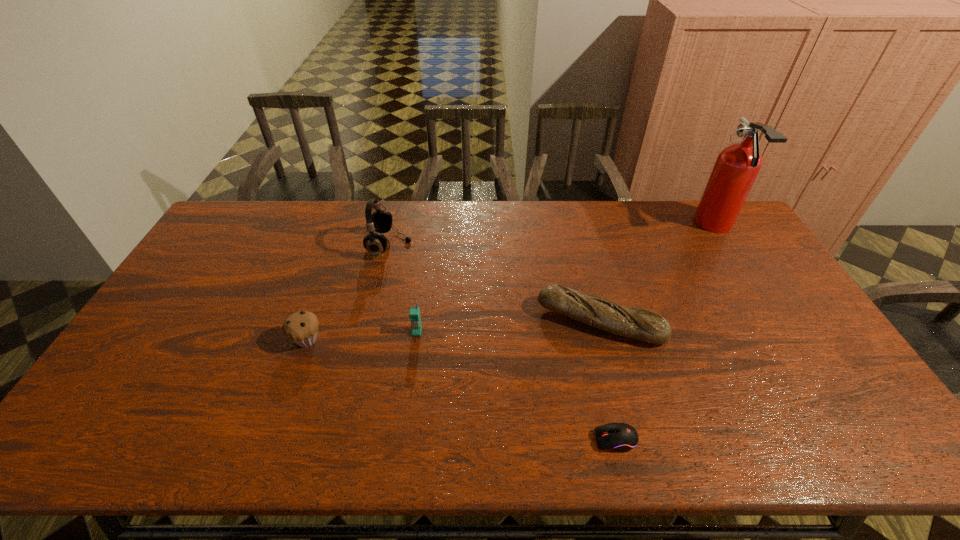
Locate an element on the screen. The height and width of the screenshot is (540, 960). free space located 0.260m on the left of the tallest object is located at coordinates (623, 226).

Find the location of `vacant space situated 0.400m with the microphone on the side of the fifth object from right to left`. vacant space situated 0.400m with the microphone on the side of the fifth object from right to left is located at coordinates (527, 245).

Where is `blank space located 0.220m on the keypad of the cellular telephone`? The height and width of the screenshot is (540, 960). blank space located 0.220m on the keypad of the cellular telephone is located at coordinates (407, 408).

Identify the location of vacant space located on the right of the muffin. (381, 340).

Where is `free space located 0.130m on the right of the baguet`? This screenshot has height=540, width=960. free space located 0.130m on the right of the baguet is located at coordinates (708, 322).

At what (x,y) coordinates should I click in order to perform the action: click on vacant space located 0.210m on the right of the nearest object. Please return your answer as a coordinate pair (x, y). Looking at the image, I should click on (728, 439).

Find the location of a particular element. Image resolution: width=960 pixels, height=540 pixels. fire extinguisher that is at the far edge is located at coordinates pyautogui.click(x=737, y=166).

Find the location of a particular element. This screenshot has width=960, height=540. headset that is at the far edge is located at coordinates (379, 221).

This screenshot has width=960, height=540. Find the location of `object located in the near edge section of the desktop`. object located in the near edge section of the desktop is located at coordinates (622, 437).

Where is `object that is at the right edge`? The height and width of the screenshot is (540, 960). object that is at the right edge is located at coordinates (737, 166).